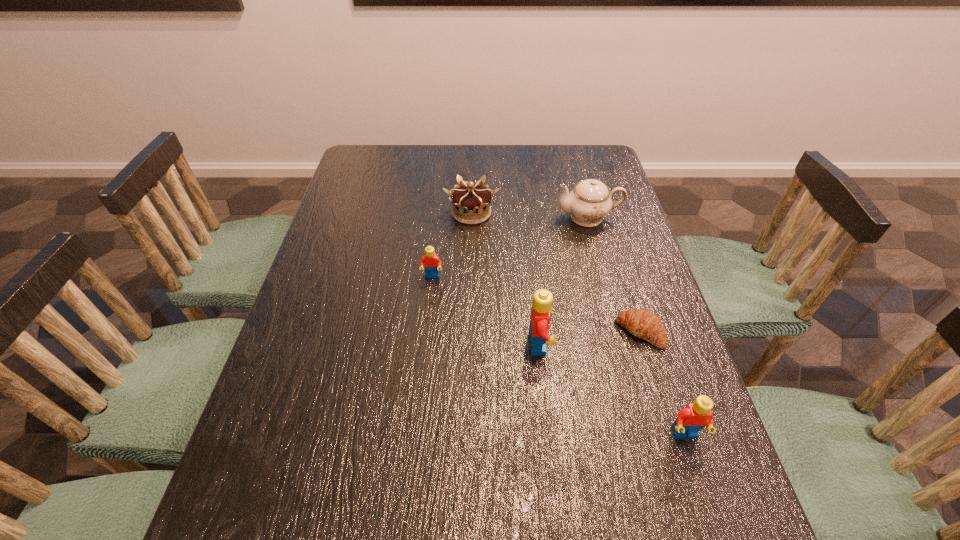
The width and height of the screenshot is (960, 540). In order to click on the shortest Lego in this screenshot , I will do `click(431, 262)`.

What are the coordinates of `the third farthest object` in the screenshot? It's located at (431, 262).

Locate an element on the screen. the second farthest Lego is located at coordinates (542, 302).

Where is `the second Lego from left to right`? Image resolution: width=960 pixels, height=540 pixels. the second Lego from left to right is located at coordinates (542, 302).

At what (x,y) coordinates should I click in order to perform the action: click on the second tallest Lego. Please return your answer as a coordinate pair (x, y). This screenshot has width=960, height=540. Looking at the image, I should click on (693, 417).

In order to click on the nearest object in this screenshot , I will do `click(693, 417)`.

Identify the location of crown. This screenshot has width=960, height=540. (471, 205).

Image resolution: width=960 pixels, height=540 pixels. What are the coordinates of `the shortest object` in the screenshot? It's located at (644, 324).

Where is `chinaware`? This screenshot has width=960, height=540. chinaware is located at coordinates (590, 201).

The height and width of the screenshot is (540, 960). In order to click on vacant space located on the face of the fourth nearest object in this screenshot , I will do `click(426, 334)`.